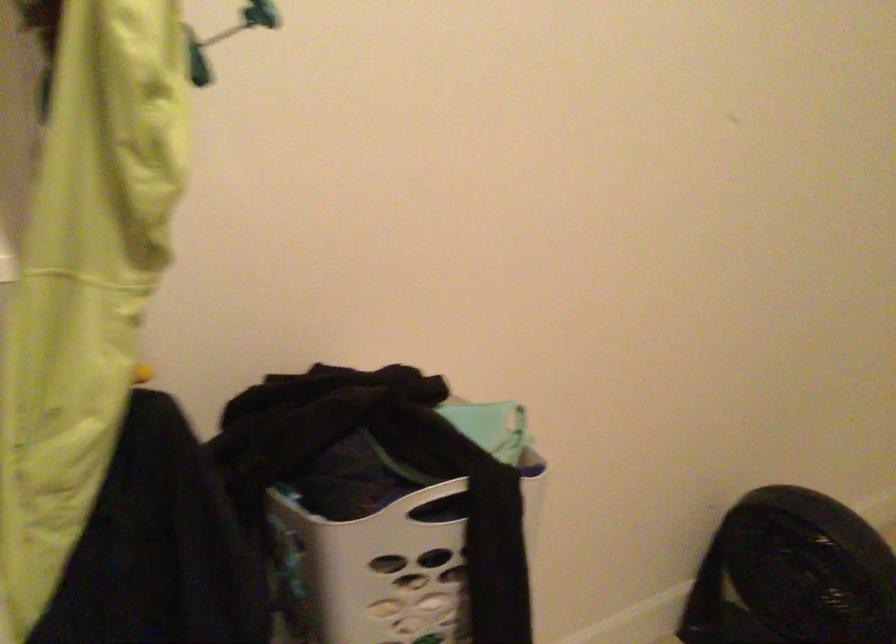
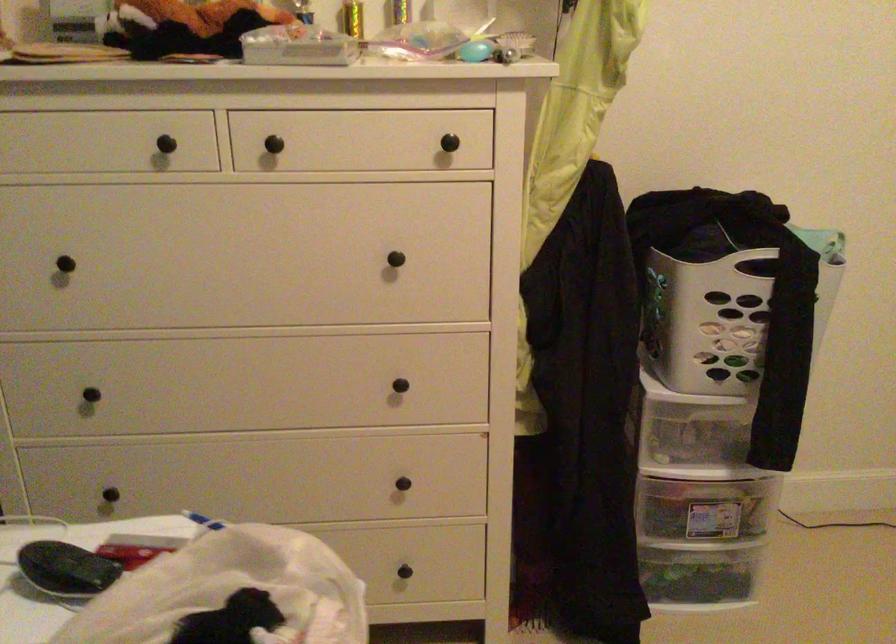
Question: The images are taken continuously from a first-person perspective. In which direction is your viewpoint rotating?

Choices:
 (A) Left
 (B) Right
 (C) Up
 (D) Down

Answer: (A)